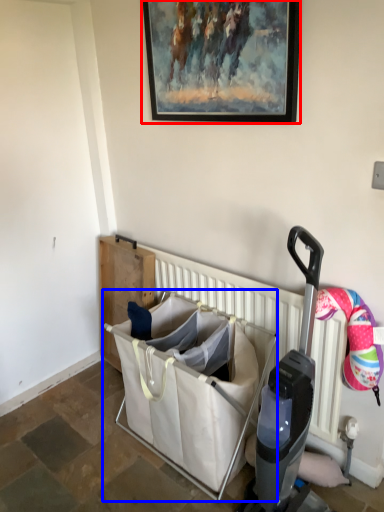
Question: Among these objects, which one is farthest to the camera, picture frame (highlighted by a red box) or baby carriage (highlighted by a blue box)?

Choices:
 (A) picture frame
 (B) baby carriage

Answer: (B)